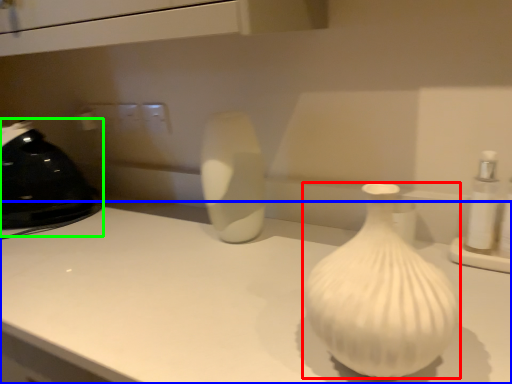
Question: Based on their relative distances, which object is farther from vase (highlighted by a red box)? Choose from counter top (highlighted by a blue box) and appliance (highlighted by a green box).

Choices:
 (A) counter top
 (B) appliance

Answer: (B)